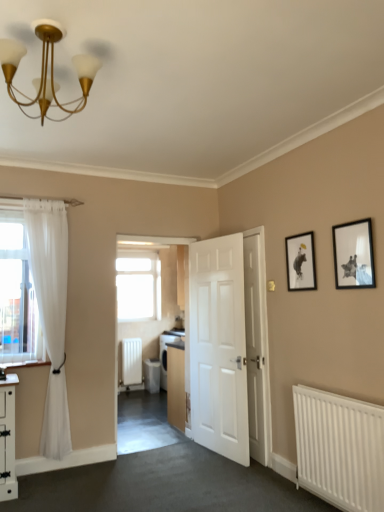
Question: Considering the positions of white smooth door at center, placed as the 2th door when sorted from left to right, and black matte picture frame at upper right, which is the second picture frame from back to front, in the image, is white smooth door at center, placed as the 2th door when sorted from left to right, taller or shorter than black matte picture frame at upper right, which is the second picture frame from back to front,?

Choices:
 (A) tall
 (B) short

Answer: (A)

Question: Is point (258, 356) closer or farther from the camera than point (365, 281)?

Choices:
 (A) farther
 (B) closer

Answer: (A)

Question: Estimate the real-world distances between objects in this image. Which object is closer to the gold metallic chandelier at upper left?

Choices:
 (A) white glossy dishwasher at center
 (B) matte black picture frame at upper right, the 2th picture frame positioned from the front
 (C) white matte door at center, the 2th door viewed from the right
 (D) transparent glass window at center
 (E) white metallic radiator at lower right, which appears as the first radiator when viewed from the right

Answer: (B)

Question: Based on their relative distances, which object is farther from the white metallic radiator at lower right, the 2th radiator viewed from the back?

Choices:
 (A) white matte radiator at center, arranged as the 2th radiator when viewed from the front
 (B) transparent glass window at center
 (C) white matte door at center, the 2th door viewed from the right
 (D) matte black picture frame at upper right, which is the 1th picture frame from left to right
 (E) white smooth door at center, which is counted as the first door, starting from the right

Answer: (A)